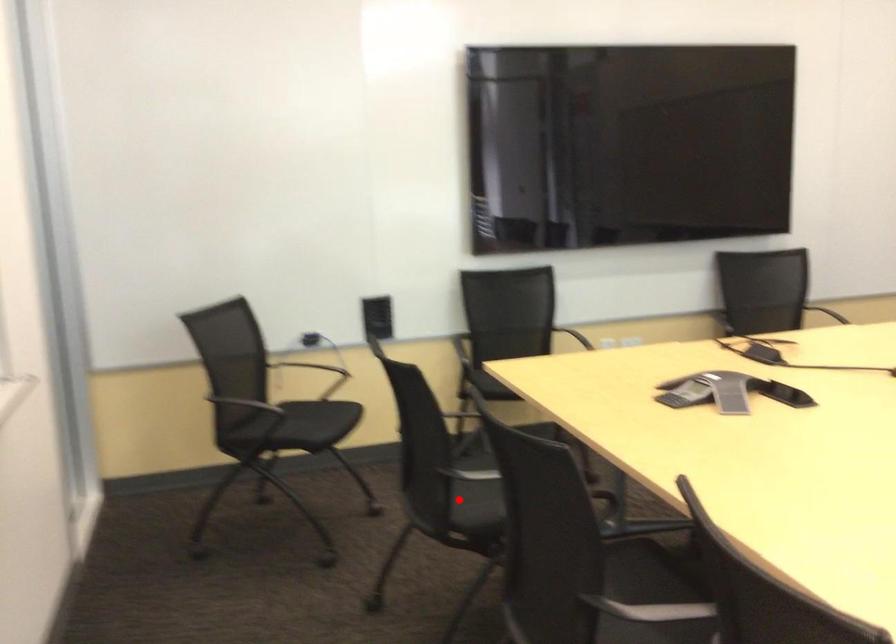
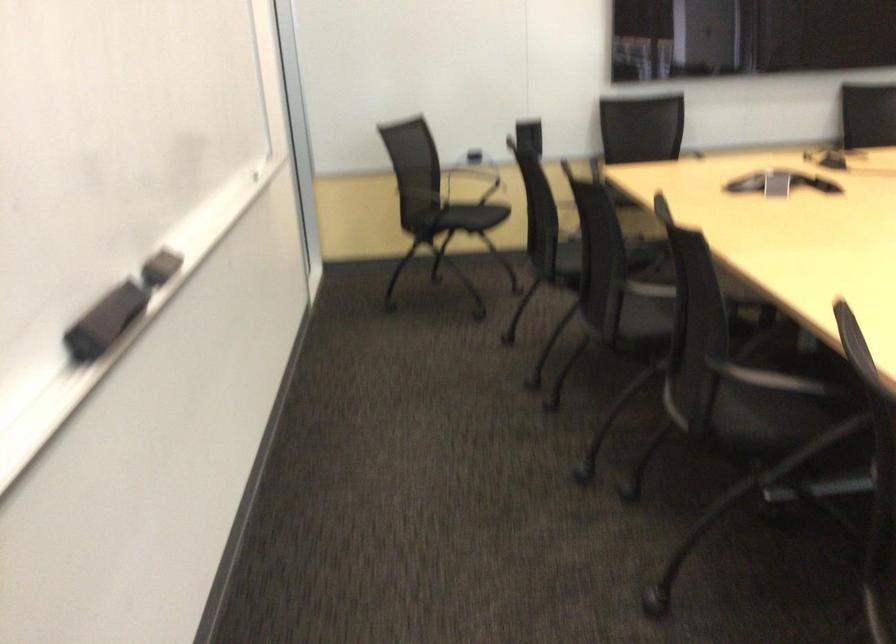
Question: I am providing you with two images of the same scene from different viewpoints. In image1, a red point is highlighted. Considering the same 3D point in image2, which of the following is correct?

Choices:
 (A) It is closer
 (B) It is farther

Answer: (B)